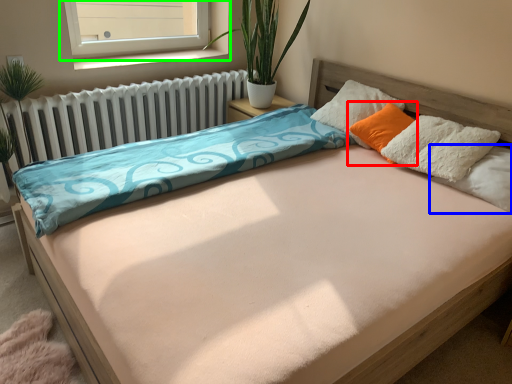
Question: Which object is positioned farthest from pillow (highlighted by a red box)? Select from pillow (highlighted by a blue box) and window (highlighted by a green box).

Choices:
 (A) pillow
 (B) window

Answer: (B)